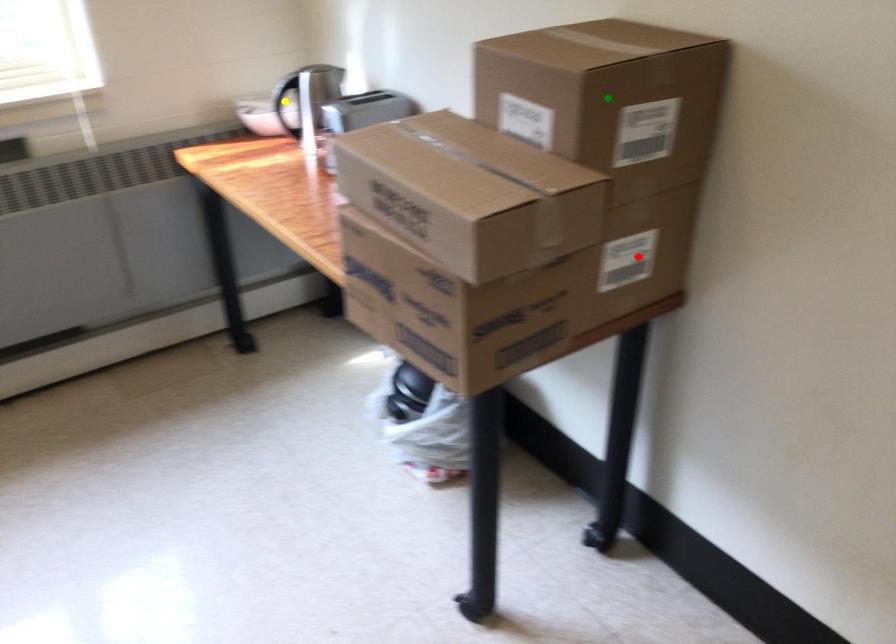
Order these from nearest to farthest:
- yellow point
- green point
- red point

yellow point, red point, green point